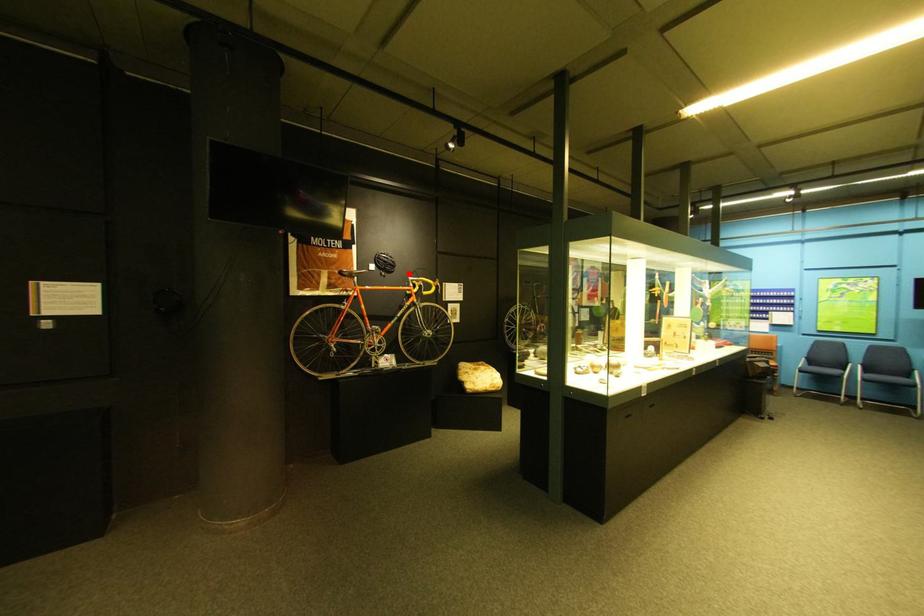
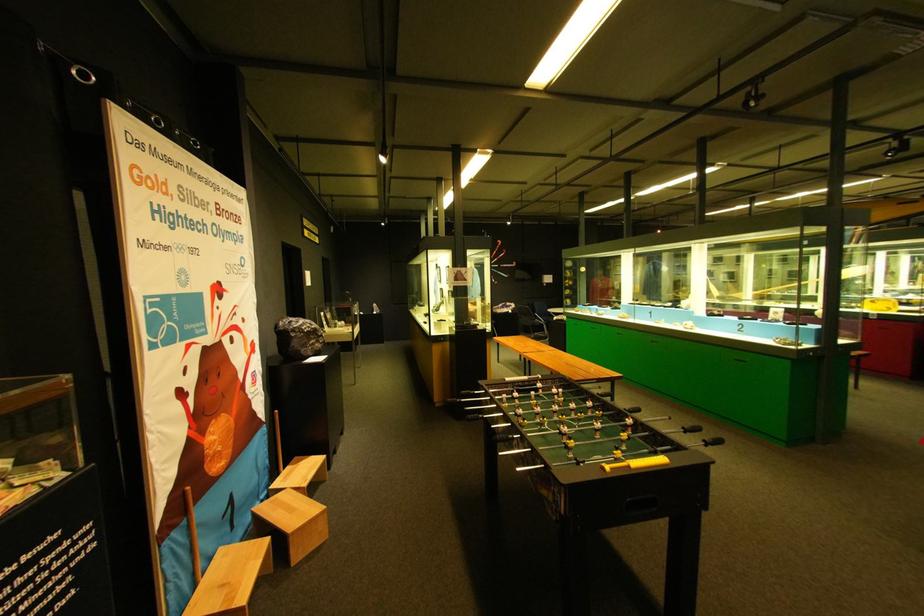
Question: I am providing you with two images of the same scene from different viewpoints. A red point is marked on the first image. At the location where the point appears in image 1, is it still visible in image 2?

Choices:
 (A) Yes
 (B) No

Answer: (B)